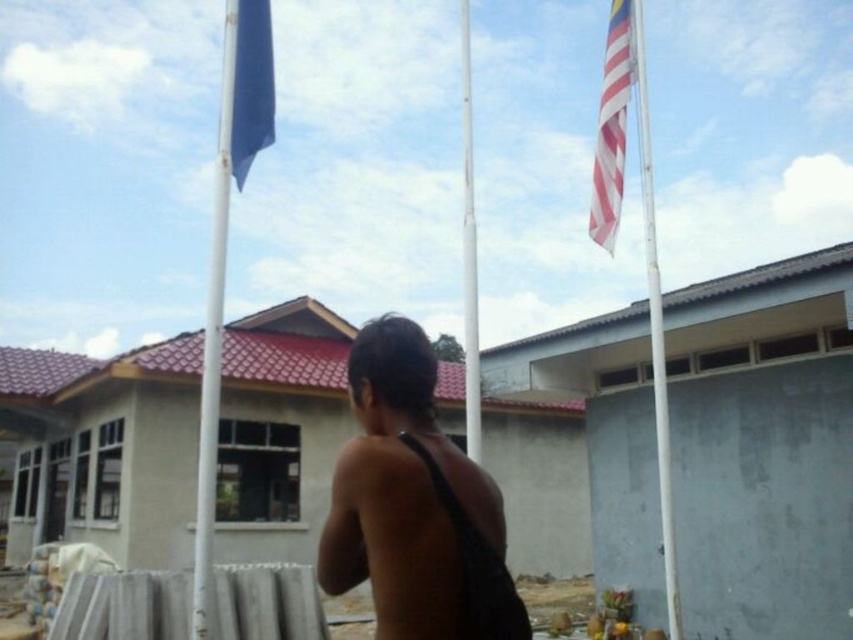
Is point (602, 148) closer to camera compared to point (463, 106)?

Yes, it is.

Is striped fabric flag at upper right to the right of white metallic pole at center from the viewer's perspective?

Yes, striped fabric flag at upper right is to the right of white metallic pole at center.

Is point (602, 172) positioned behind point (465, 132)?

That is False.

Locate an element on the screen. The width and height of the screenshot is (853, 640). striped fabric flag at upper right is located at coordinates (612, 124).

Does blue fabric flag at upper left have a smaller size compared to white metallic pole at center?

Correct, blue fabric flag at upper left occupies less space than white metallic pole at center.

How far apart are blue fabric flag at upper left and white metallic pole at center?

blue fabric flag at upper left is 3.34 meters from white metallic pole at center.

Who is more forward, (238, 68) or (469, 93)?

Positioned in front is point (238, 68).

This screenshot has width=853, height=640. In order to click on blue fabric flag at upper left in this screenshot , I will do `click(251, 86)`.

Is the position of white glossy flag pole at left more distant than that of white metallic pole at center?

No, white glossy flag pole at left is in front of white metallic pole at center.

Between white glossy flag pole at left and white metallic pole at center, which one appears on the left side from the viewer's perspective?

From the viewer's perspective, white glossy flag pole at left appears more on the left side.

Is point (210, 304) in front of point (465, 20)?

That is True.

Where is `white glossy flag pole at left`? white glossy flag pole at left is located at coordinates (213, 346).